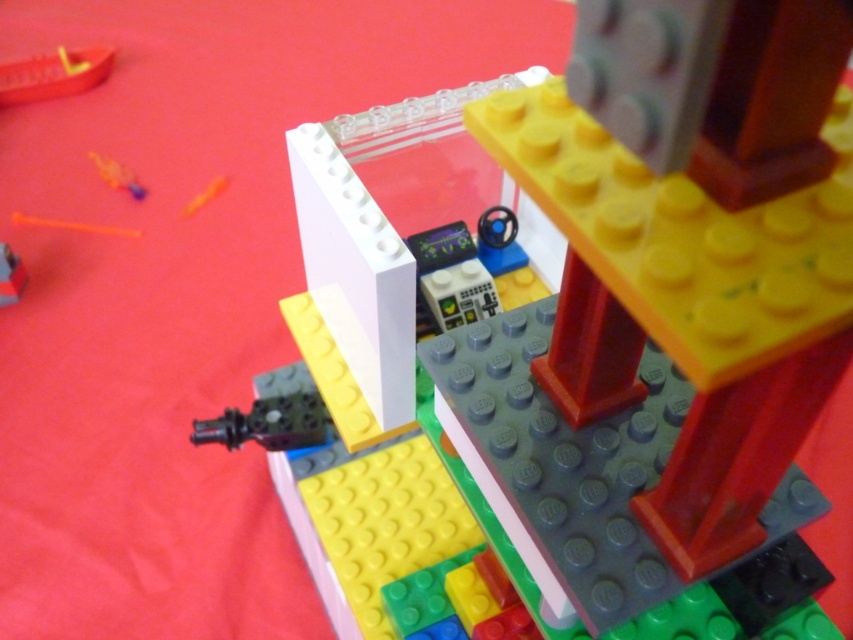
Question: Is smooth orange boat at upper left bigger than translucent plastic toy at upper left?

Choices:
 (A) no
 (B) yes

Answer: (B)

Question: Which point appears closest to the camera in this image?

Choices:
 (A) (97, 72)
 (B) (18, 296)

Answer: (B)

Question: Is matte black brick at lower left below translucent plastic toy at upper left?

Choices:
 (A) yes
 (B) no

Answer: (A)

Question: Is smooth orange boat at upper left smaller than matte black brick at lower left?

Choices:
 (A) yes
 (B) no

Answer: (B)

Question: Estimate the real-world distances between objects in this image. Which object is closer to the smooth orange boat at upper left?

Choices:
 (A) matte black brick at lower left
 (B) translucent plastic toy at upper left

Answer: (B)

Question: Which object appears closest to the camera in this image?

Choices:
 (A) translucent plastic toy at upper left
 (B) smooth orange boat at upper left

Answer: (A)